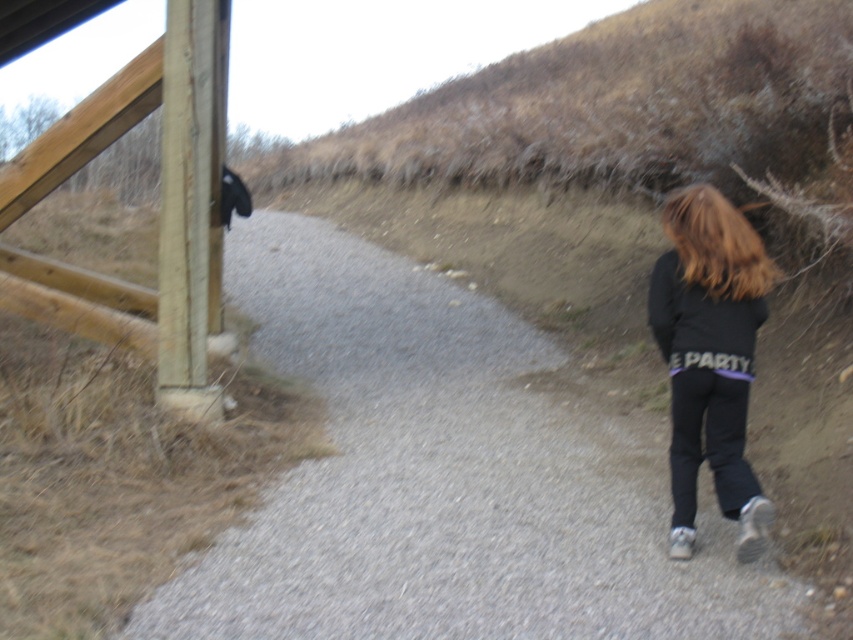
You are standing at the starting point of the gravel path and want to place a small sign on the light brown wooden rail at left. Can you confirm the exact coordinates where the rail is located?

The light brown wooden rail at left is located at point coordinates [160,182], so you can place the sign there.